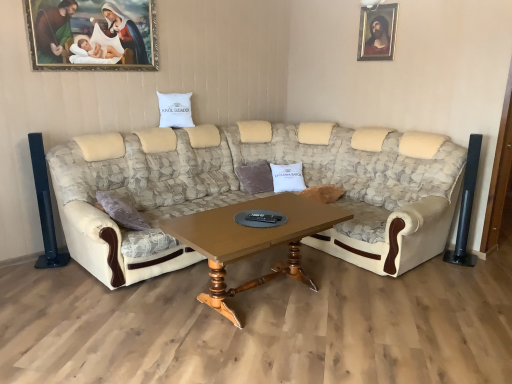
This screenshot has width=512, height=384. Find the location of `vacant region above wooden polished table at center (from a real-world perspective)`. vacant region above wooden polished table at center (from a real-world perspective) is located at coordinates (258, 224).